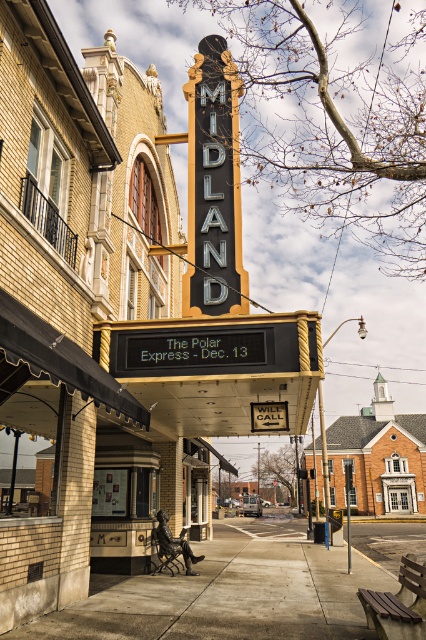
Is the position of gray concrete sidewalk at lower center more distant than that of matte black sign at center?

No, it is not.

Looking at this image, does gray concrete sidewalk at lower center have a greater height compared to matte black sign at center?

Indeed, gray concrete sidewalk at lower center has a greater height compared to matte black sign at center.

This screenshot has height=640, width=426. In order to click on gray concrete sidewalk at lower center in this screenshot , I will do `click(241, 588)`.